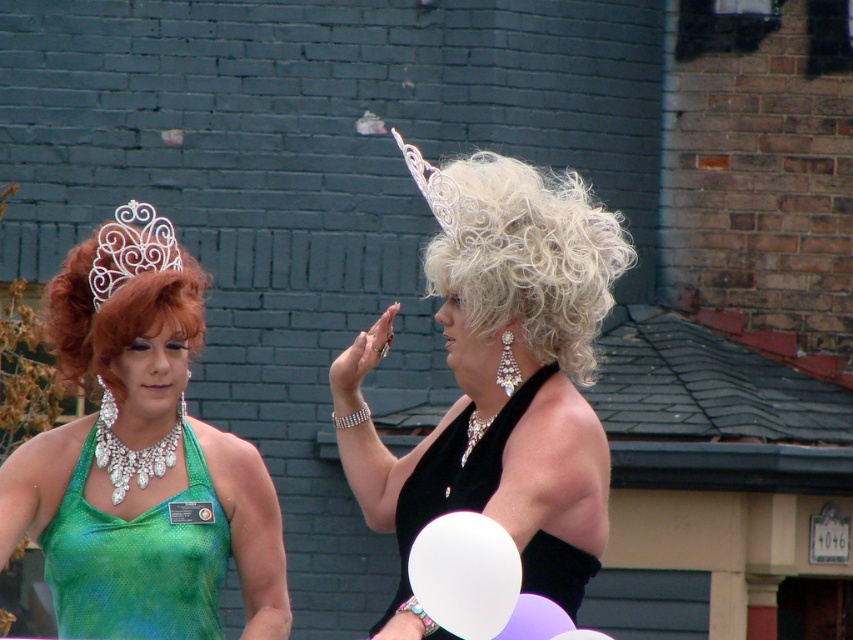
You are a photographer at the event and need to position yourself to capture both the green shiny dress at left and the black outfit with feather headpiece at right in the same frame. Given that the camera has a 90 degree field of view, can you determine if both subjects will fit in the frame if you position yourself directly in front of the point marked at coordinates (138, 560)?

The point at (138, 560) marks the green shiny dress at left. Since the photographer is positioned directly in front of this point, the green shiny dress at left will be centered in the frame. The black outfit with feather headpiece at right is positioned to the right of this point. With a 90 degree field of view, the camera can capture a wide enough angle to include both subjects in the frame as they are positioned to either side of the central point.

You are a photographer at the event and want to capture a photo where both the green shiny dress at left and the sparkling diamond necklace at center are visible. Based on their positions, which object should be placed lower in the frame to ensure both are in the shot?

The green shiny dress at left is below the sparkling diamond necklace at center, so to include both in the frame, the dress should be placed lower while positioning the necklace higher.